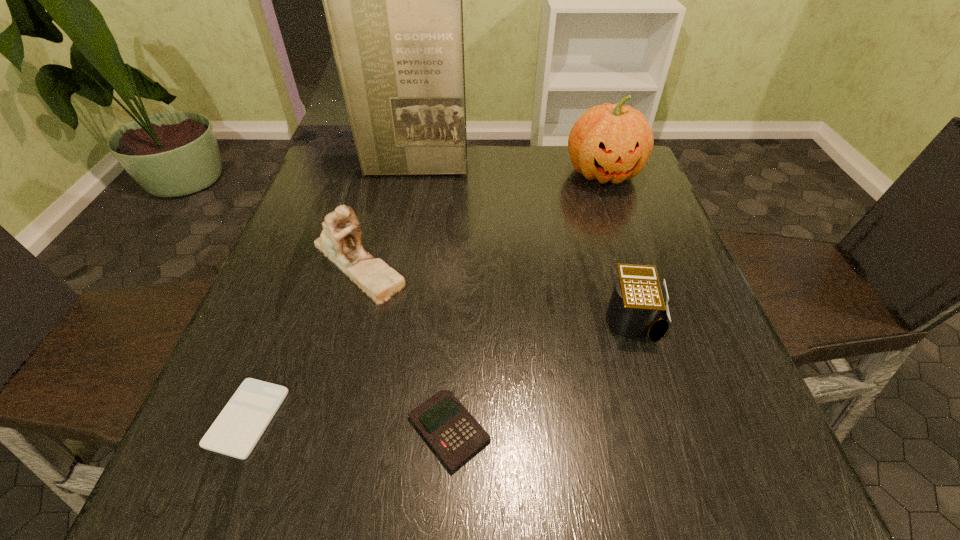
The width and height of the screenshot is (960, 540). What are the coordinates of `vacant space located on the carved face of the pumpkin` in the screenshot? It's located at (630, 251).

Find the location of a particular element. This screenshot has height=540, width=960. vacant space located on the front-facing side of the fourth shortest object is located at coordinates (338, 338).

The height and width of the screenshot is (540, 960). Identify the location of free space located on the left of the rightmost calculator. (441, 319).

Locate an element on the screen. The height and width of the screenshot is (540, 960). vacant space located 0.080m on the back of the second calculator from left to right is located at coordinates (453, 354).

This screenshot has width=960, height=540. In order to click on vacant area located on the back of the shortest calculator in this screenshot , I will do `click(291, 306)`.

Identify the location of phonebook located at the far edge. This screenshot has width=960, height=540. (393, 3).

The image size is (960, 540). Find the location of `pumpkin that is at the far edge`. pumpkin that is at the far edge is located at coordinates (608, 142).

Find the location of `phonebook that is at the left edge`. phonebook that is at the left edge is located at coordinates (393, 3).

This screenshot has width=960, height=540. Find the location of `figurine that is at the left edge`. figurine that is at the left edge is located at coordinates (340, 241).

You are a GUI agent. You are given a task and a screenshot of the screen. Output one action in this format:
    pyautogui.click(x=<x>, y=<y>)
    Task: Click on the calculator situated at the left edge
    The image size is (960, 540).
    Given the screenshot: What is the action you would take?
    tap(235, 432)